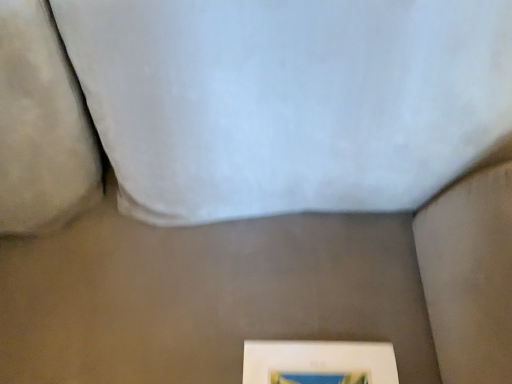
The width and height of the screenshot is (512, 384). I want to click on white matte picture frame at lower center, so click(x=319, y=362).

The image size is (512, 384). Describe the element at coordinates (319, 362) in the screenshot. I see `white matte picture frame at lower center` at that location.

Locate an element on the screen. white matte picture frame at lower center is located at coordinates (319, 362).